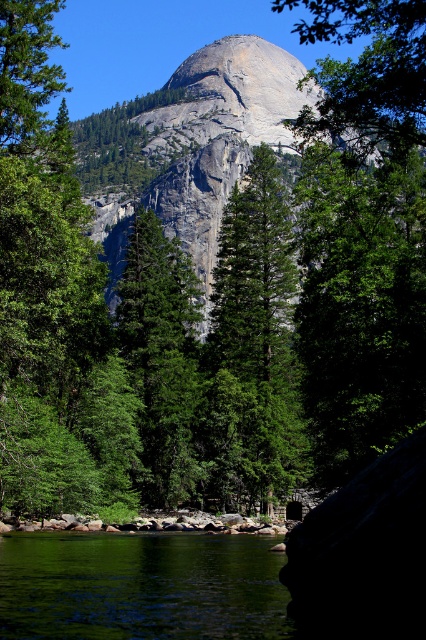
You are standing at the edge of the green smooth water at lower left and want to reach the gray granite mountain at center. Which direction should you walk to get closer to the mountain?

You should walk towards the center because the green smooth water at lower left is in front of the gray granite mountain at center, meaning the mountain is behind the water from your current position.

You are standing in the landscape and want to take a photo of both the green smooth water at lower left and the green matte tree at center. Which object should you focus on first to ensure both are in clear view?

You should focus on the green smooth water at lower left first because it is closer to you than the green matte tree at center, ensuring both are in focus when using a camera with depth of field considerations.

You are standing in the middle of the scene and want to take a photo of both the green textured tree at center and the green matte tree at center. Which tree should you focus on first if you want to capture both in the same frame without moving the camera?

You should focus on the green textured tree at center first because it is taller than the green matte tree at center, ensuring it fits within the frame.